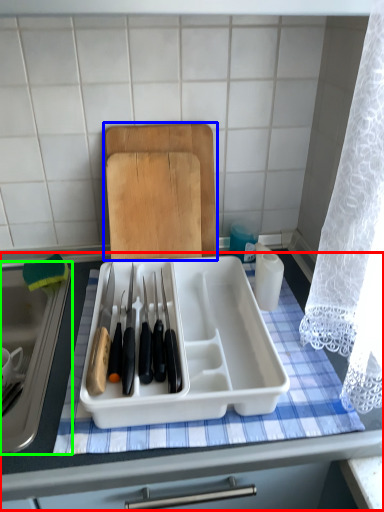
Question: Which object is the closest to the table (highlighted by a red box)? Choose among these: cutting board (highlighted by a blue box) or sink (highlighted by a green box).

Choices:
 (A) cutting board
 (B) sink

Answer: (B)